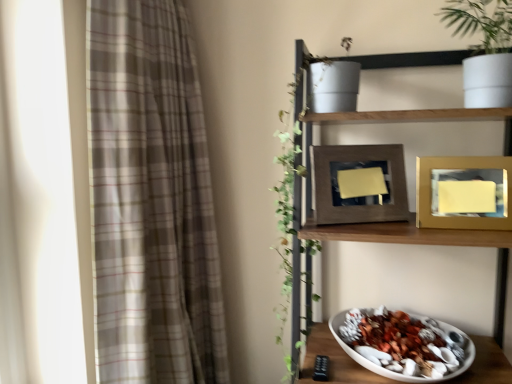
Question: From the image's perspective, would you say plaid fabric curtain at left is positioned over white matte bowl at lower right?

Choices:
 (A) yes
 (B) no

Answer: (A)

Question: Are plaid fabric curtain at left and white matte bowl at lower right beside each other?

Choices:
 (A) yes
 (B) no

Answer: (B)

Question: Does plaid fabric curtain at left have a lesser width compared to white matte bowl at lower right?

Choices:
 (A) yes
 (B) no

Answer: (A)

Question: Does plaid fabric curtain at left appear on the left side of white matte bowl at lower right?

Choices:
 (A) yes
 (B) no

Answer: (A)

Question: Does plaid fabric curtain at left come in front of white matte bowl at lower right?

Choices:
 (A) no
 (B) yes

Answer: (B)

Question: Considering the relative sizes of plaid fabric curtain at left and white matte bowl at lower right in the image provided, is plaid fabric curtain at left bigger than white matte bowl at lower right?

Choices:
 (A) no
 (B) yes

Answer: (B)

Question: From a real-world perspective, does white matte bowl at lower right stand above gold metallic picture frame at upper right, which is the second picture frame in left-to-right order?

Choices:
 (A) no
 (B) yes

Answer: (A)

Question: Considering the relative sizes of white matte bowl at lower right and gold metallic picture frame at upper right, which is the second picture frame in left-to-right order, in the image provided, is white matte bowl at lower right bigger than gold metallic picture frame at upper right, which is the second picture frame in left-to-right order,?

Choices:
 (A) yes
 (B) no

Answer: (A)

Question: Is gold metallic picture frame at upper right, which ranks as the 1th picture frame in right-to-left order, surrounded by white matte bowl at lower right?

Choices:
 (A) yes
 (B) no

Answer: (B)

Question: Does white matte bowl at lower right lie behind gold metallic picture frame at upper right, which ranks as the 1th picture frame in right-to-left order?

Choices:
 (A) no
 (B) yes

Answer: (A)

Question: Is the surface of white matte bowl at lower right in direct contact with gold metallic picture frame at upper right, which is the second picture frame in left-to-right order?

Choices:
 (A) no
 (B) yes

Answer: (A)

Question: Could you tell me if white matte bowl at lower right is facing gold metallic picture frame at upper right, which is the second picture frame in left-to-right order?

Choices:
 (A) yes
 (B) no

Answer: (B)

Question: Is plaid fabric curtain at left at the right side of wooden shelf at upper right?

Choices:
 (A) no
 (B) yes

Answer: (A)